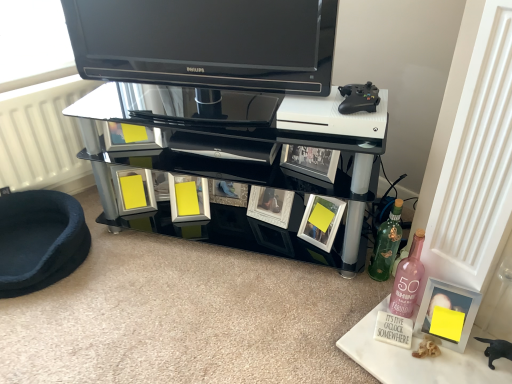
Question: From the image's perspective, is pink glass bottle at lower right, the second bottle when ordered from back to front, positioned above or below black glossy television at upper center?

Choices:
 (A) above
 (B) below

Answer: (B)

Question: Considering the positions of pink glass bottle at lower right, which appears as the first bottle when viewed from the front, and black glossy television at upper center in the image, is pink glass bottle at lower right, which appears as the first bottle when viewed from the front, taller or shorter than black glossy television at upper center?

Choices:
 (A) tall
 (B) short

Answer: (B)

Question: Estimate the real-world distances between objects in this image. Which object is farther from the pink glass bottle at lower right, the second bottle when ordered from back to front?

Choices:
 (A) matte silver picture frame at lower right, which is the 2th picture frame in left-to-right order
 (B) dark blue plush pet bed at lower left
 (C) white glossy picture frame at lower center, the 1th picture frame positioned from the left
 (D) green glass bottle at lower right, arranged as the first bottle when viewed from the back
 (E) black glass shelf at center

Answer: (B)

Question: Which of these objects is positioned closest to the pink glass bottle at lower right, which appears as the first bottle when viewed from the front?

Choices:
 (A) black glass shelf at center
 (B) matte silver picture frame at lower right, which appears as the first picture frame when viewed from the right
 (C) dark blue plush pet bed at lower left
 (D) white glossy picture frame at lower center, the 1th picture frame positioned from the left
 (E) black glossy television at upper center

Answer: (B)